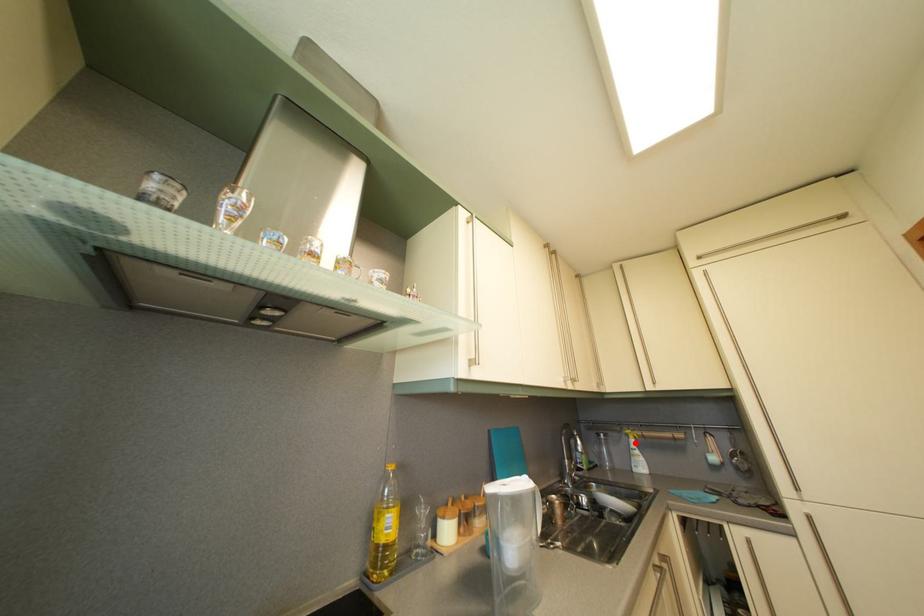
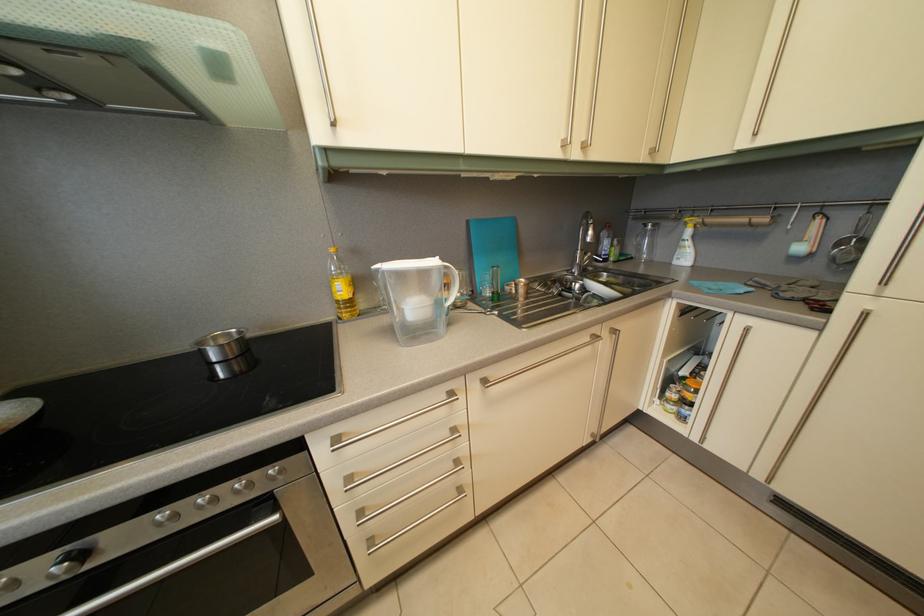
The point at the highlighted location is marked in the first image. Where is the corresponding point in the second image?

(694, 232)